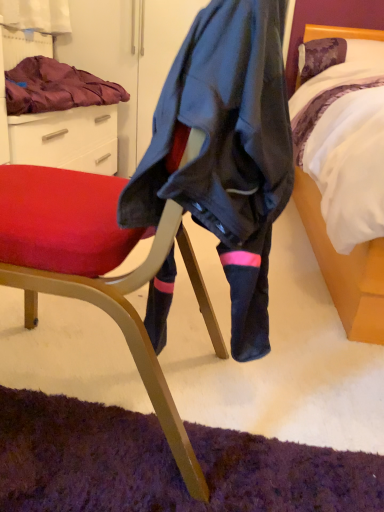
Question: Is point (16, 76) closer or farther from the camera than point (372, 334)?

Choices:
 (A) closer
 (B) farther

Answer: (B)

Question: In terms of width, does velvet purple blanket at upper left look wider or thinner when compared to white satin bed at right?

Choices:
 (A) thin
 (B) wide

Answer: (A)

Question: Based on their relative distances, which object is nearer to the velvet purple blanket at upper left?

Choices:
 (A) white satin bed at right
 (B) matte black chair at center

Answer: (B)

Question: Which object is positioned closest to the velvet purple blanket at upper left?

Choices:
 (A) white satin bed at right
 (B) matte black chair at center

Answer: (B)